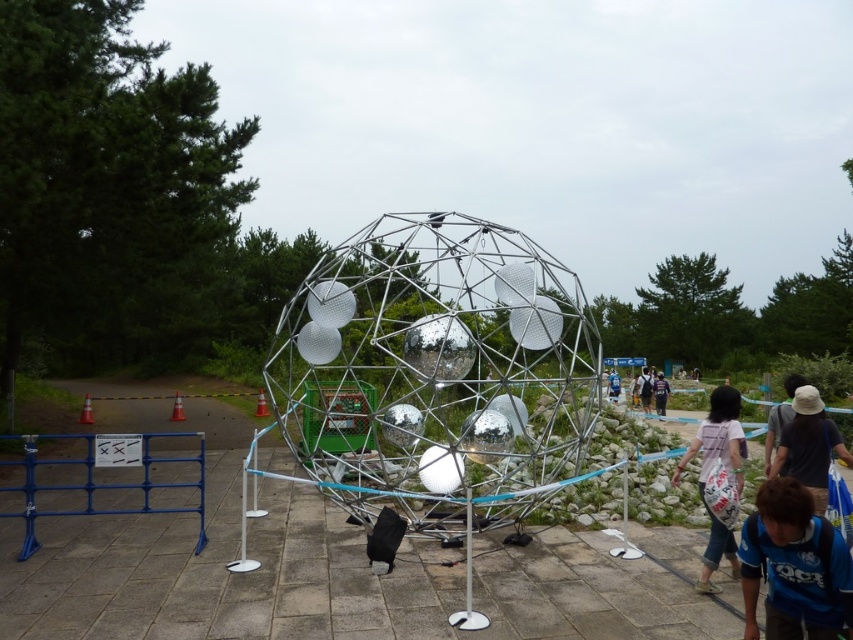
Question: Which of these objects is positioned farthest from the white fabric bag at lower right?

Choices:
 (A) blue jersey at center
 (B) dark gray fabric bag at lower right
 (C) dark blue shirt at center

Answer: (C)

Question: Estimate the real-world distances between objects in this image. Which object is closer to the blue jersey at center?

Choices:
 (A) purple fabric bag at center
 (B) white fabric bag at lower right

Answer: (B)

Question: Does blue jersey at center appear under purple fabric bag at center?

Choices:
 (A) no
 (B) yes

Answer: (A)

Question: Which of the following is the farthest from the observer?

Choices:
 (A) dark blue shirt at center
 (B) blue denim jacket at center
 (C) dark gray fabric bag at lower right

Answer: (A)

Question: Where is purple fabric bag at center located in relation to blue denim jacket at center in the image?

Choices:
 (A) left
 (B) right

Answer: (A)

Question: Is dark blue shirt at center closer to the viewer compared to blue denim jacket at center?

Choices:
 (A) yes
 (B) no

Answer: (B)